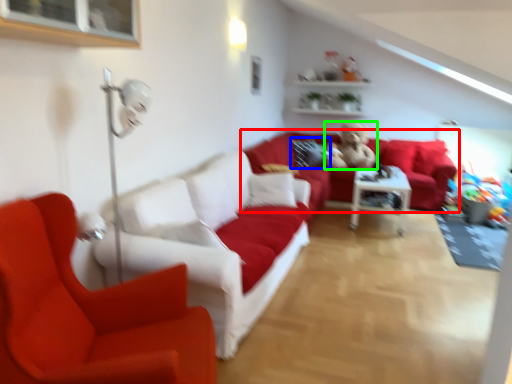
Question: Which object is positioned farthest from studio couch (highlighted by a red box)? Select from pillow (highlighted by a blue box) and figurine (highlighted by a green box).

Choices:
 (A) pillow
 (B) figurine

Answer: (B)